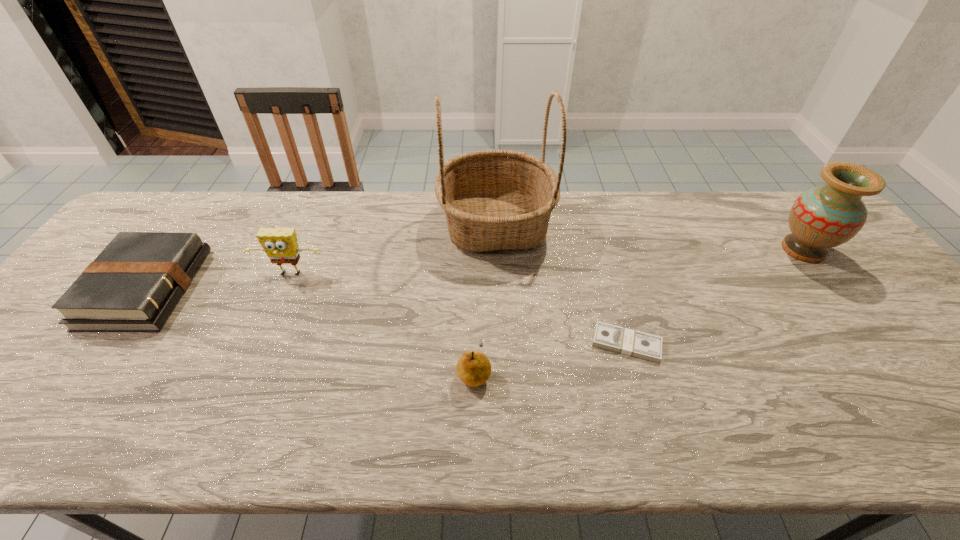
Where is `object at the far right corner`? The height and width of the screenshot is (540, 960). object at the far right corner is located at coordinates (822, 217).

Locate an element on the screen. Image resolution: width=960 pixels, height=540 pixels. free spot at the far edge of the desktop is located at coordinates (199, 206).

At what (x,y) coordinates should I click in order to perform the action: click on free space at the near edge. Please return your answer as a coordinate pair (x, y). The height and width of the screenshot is (540, 960). Looking at the image, I should click on (812, 413).

In the image, there is a desktop. In order to click on vacant space at the right edge in this screenshot , I will do `click(852, 254)`.

In the image, there is a desktop. At what (x,y) coordinates should I click in order to perform the action: click on vacant space at the far left corner. Please return your answer as a coordinate pair (x, y). The height and width of the screenshot is (540, 960). Looking at the image, I should click on (183, 222).

In the image, there is a desktop. What are the coordinates of `vacant space at the far right corner` in the screenshot? It's located at (758, 199).

The image size is (960, 540). In order to click on vacant point located between the pear and the basket in this screenshot , I will do `click(485, 298)`.

In order to click on vacant point located between the hardback book and the second tallest object in this screenshot , I will do `click(474, 269)`.

Find the location of a particular element. free space between the sponge and the second object from right to left is located at coordinates (459, 309).

Locate an element on the screen. This screenshot has height=540, width=960. vacant area that lies between the fourth tallest object and the hardback book is located at coordinates (310, 330).